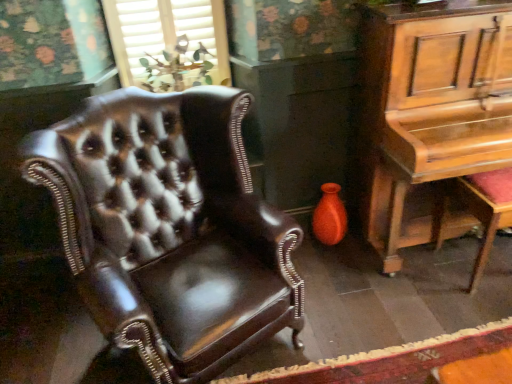
Question: Is shiny brown leather armchair at left facing away from red cushioned stool at right?

Choices:
 (A) yes
 (B) no

Answer: (B)

Question: From the image's perspective, would you say shiny brown leather armchair at left is shown under red cushioned stool at right?

Choices:
 (A) yes
 (B) no

Answer: (A)

Question: Is shiny brown leather armchair at left not within red cushioned stool at right?

Choices:
 (A) yes
 (B) no

Answer: (A)

Question: Is the position of shiny brown leather armchair at left less distant than that of red cushioned stool at right?

Choices:
 (A) no
 (B) yes

Answer: (B)

Question: Does shiny brown leather armchair at left have a lesser height compared to red cushioned stool at right?

Choices:
 (A) yes
 (B) no

Answer: (B)

Question: Considering the positions of wooden piano at right and matte wood window at upper center in the image, is wooden piano at right wider or thinner than matte wood window at upper center?

Choices:
 (A) thin
 (B) wide

Answer: (B)

Question: In the image, is wooden piano at right positioned in front of or behind matte wood window at upper center?

Choices:
 (A) front
 (B) behind

Answer: (A)

Question: Is wooden piano at right to the left or to the right of matte wood window at upper center in the image?

Choices:
 (A) right
 (B) left

Answer: (A)

Question: From a real-world perspective, is wooden piano at right above or below matte wood window at upper center?

Choices:
 (A) below
 (B) above

Answer: (A)

Question: Considering the positions of point (396, 210) and point (336, 223), is point (396, 210) closer or farther from the camera than point (336, 223)?

Choices:
 (A) farther
 (B) closer

Answer: (B)

Question: In terms of size, does wooden piano at right appear bigger or smaller than matte orange vase at lower right?

Choices:
 (A) big
 (B) small

Answer: (A)

Question: Considering their positions, is wooden piano at right located in front of or behind matte orange vase at lower right?

Choices:
 (A) behind
 (B) front

Answer: (B)

Question: From a real-world perspective, is wooden piano at right above or below matte orange vase at lower right?

Choices:
 (A) above
 (B) below

Answer: (A)

Question: Is red cushioned stool at right taller or shorter than matte orange vase at lower right?

Choices:
 (A) tall
 (B) short

Answer: (A)

Question: From the image's perspective, is red cushioned stool at right above or below matte orange vase at lower right?

Choices:
 (A) below
 (B) above

Answer: (A)